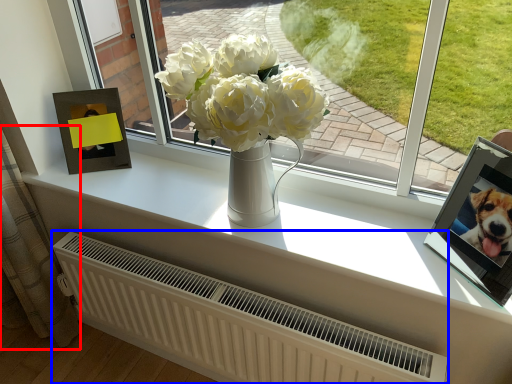
Question: Which of the following is the closest to the observer, curtain (highlighted by a red box) or radiator (highlighted by a blue box)?

Choices:
 (A) curtain
 (B) radiator

Answer: (B)